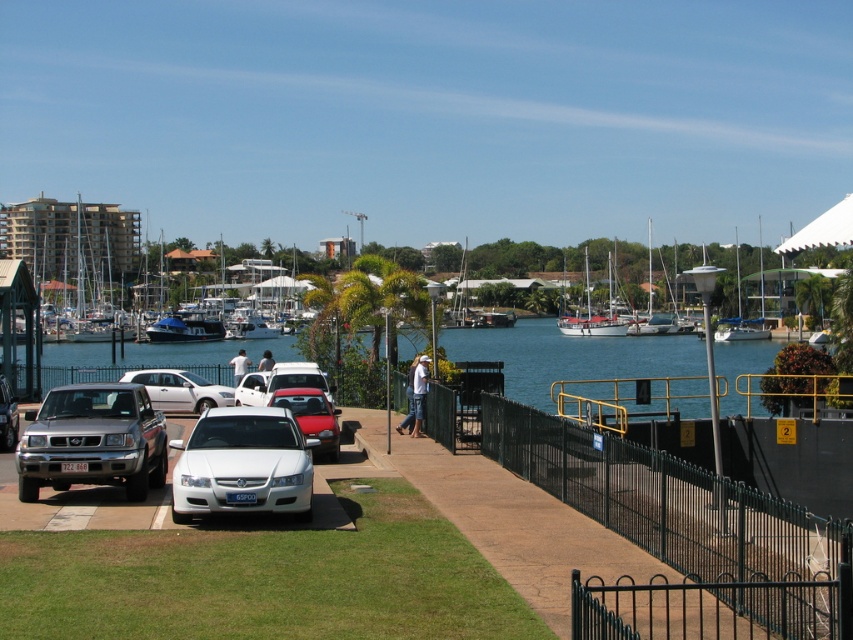
Consider the image. Is metallic red car at center positioned at the back of light blue shirt at center?

No.

Is metallic red car at center smaller than light blue shirt at center?

Yes, metallic red car at center is smaller than light blue shirt at center.

Is point (316, 433) closer to viewer compared to point (271, 358)?

That is True.

Find the location of a particular element. metallic red car at center is located at coordinates (311, 417).

Does white matte sedan at center appear on the left side of white fabric person at center?

Yes, white matte sedan at center is to the left of white fabric person at center.

Is white matte sedan at center bigger than white fabric person at center?

Indeed, white matte sedan at center has a larger size compared to white fabric person at center.

The width and height of the screenshot is (853, 640). Describe the element at coordinates (180, 388) in the screenshot. I see `white matte sedan at center` at that location.

Locate an element on the screen. The width and height of the screenshot is (853, 640). white matte sedan at center is located at coordinates (180, 388).

Between silver metallic suv at lower left and metallic red car at center, which one appears on the left side from the viewer's perspective?

silver metallic suv at lower left is more to the left.

Does silver metallic suv at lower left appear over metallic red car at center?

Incorrect, silver metallic suv at lower left is not positioned above metallic red car at center.

This screenshot has height=640, width=853. Describe the element at coordinates (93, 440) in the screenshot. I see `silver metallic suv at lower left` at that location.

Find the location of `silver metallic suv at lower left`. silver metallic suv at lower left is located at coordinates tap(93, 440).